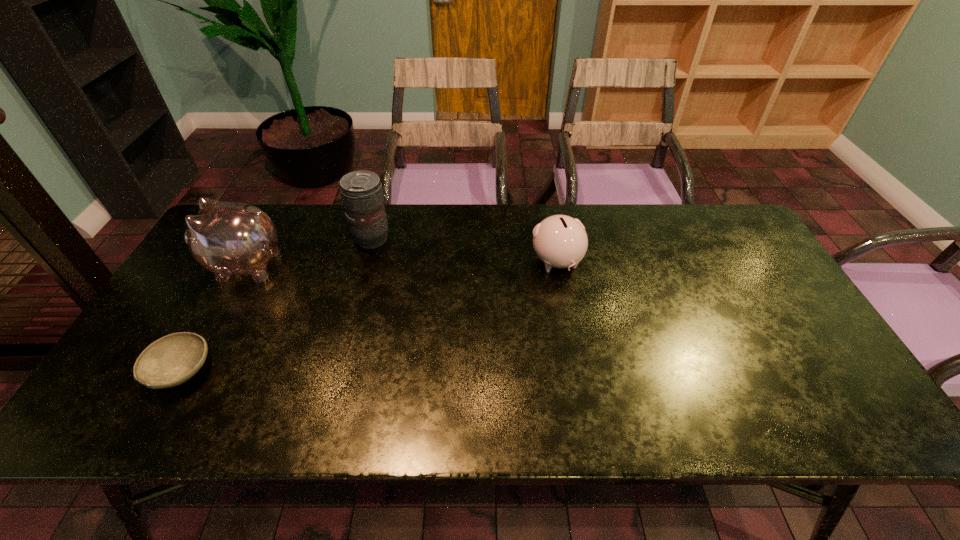
Where is `object located at the near edge`? object located at the near edge is located at coordinates (170, 361).

The height and width of the screenshot is (540, 960). Find the location of `piggy bank present at the left edge`. piggy bank present at the left edge is located at coordinates (227, 238).

The width and height of the screenshot is (960, 540). I want to click on bowl positioned at the left edge, so click(170, 361).

Locate an element on the screen. object located at the far left corner is located at coordinates point(227,238).

You are a GUI agent. You are given a task and a screenshot of the screen. Output one action in this format:
    pyautogui.click(x=<x>, y=<y>)
    Task: Click on the object positioned at the near left corner
    This screenshot has width=960, height=540.
    Given the screenshot: What is the action you would take?
    pyautogui.click(x=170, y=361)

The height and width of the screenshot is (540, 960). In the image, there is a desktop. Identify the location of vacant space at the far edge. (460, 243).

In the image, there is a desktop. In order to click on free space at the near edge in this screenshot , I will do (266, 421).

Identify the location of vacant area at the near right corner. Image resolution: width=960 pixels, height=540 pixels. (861, 428).

Find the location of `empty space that is in between the telephoto lens and the bowl`. empty space that is in between the telephoto lens and the bowl is located at coordinates (276, 305).

Locate an element on the screen. vacant point located between the third object from left to right and the shortest object is located at coordinates (276, 305).